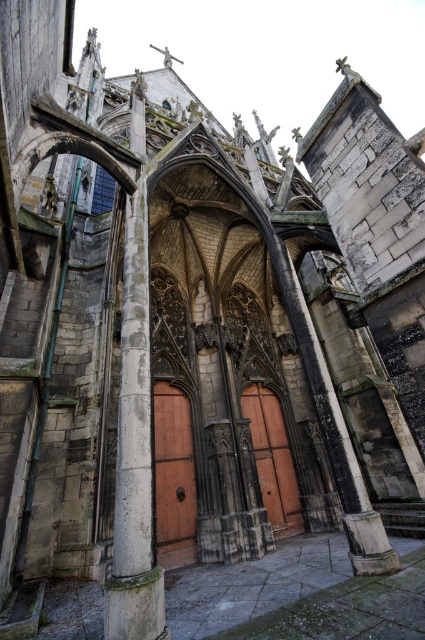
Question: Among these points, which one is nearest to the camera?

Choices:
 (A) (280, 484)
 (B) (127, 340)

Answer: (B)

Question: Which of the following is the farthest from the observer?

Choices:
 (A) (158, 394)
 (B) (122, 301)

Answer: (A)

Question: Can you confirm if stone column at center is wider than brown wooden door at center?

Choices:
 (A) yes
 (B) no

Answer: (A)

Question: Is wooden door at center further to camera compared to brown wooden door at center?

Choices:
 (A) no
 (B) yes

Answer: (A)

Question: Among these objects, which one is farthest from the camera?

Choices:
 (A) brown wooden door at center
 (B) wooden door at center

Answer: (A)

Question: Can you confirm if stone column at center is positioned to the left of wooden door at center?

Choices:
 (A) no
 (B) yes

Answer: (B)